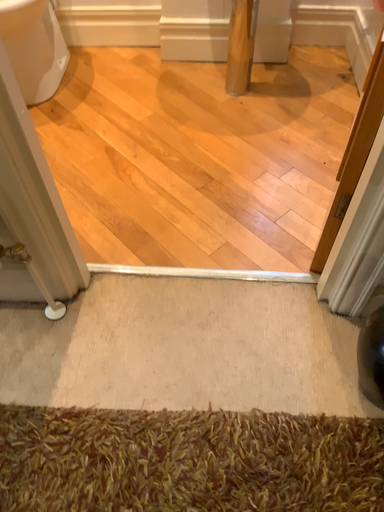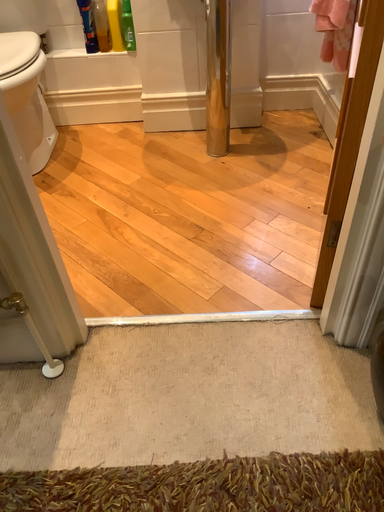
Question: How did the camera likely rotate when shooting the video?

Choices:
 (A) rotated upward
 (B) rotated downward

Answer: (A)